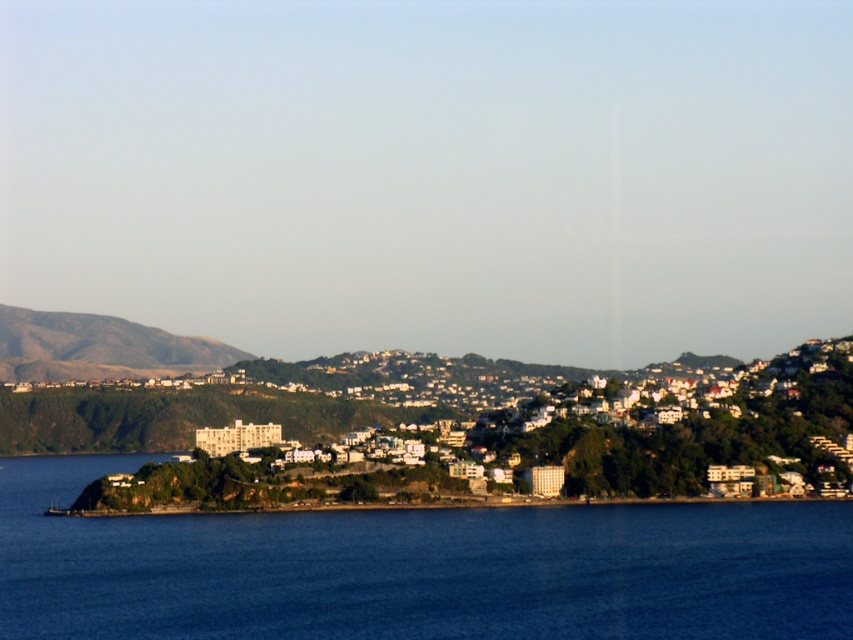
Consider the image. You are a drone operator tasked with capturing aerial footage of the blue liquid water at lower left and the white matte building at center. Based on their relative heights, which object should you focus on first to ensure proper framing?

The blue liquid water at lower left is much taller than the white matte building at center, so you should focus on the blue liquid water at lower left first to ensure proper framing.

Based on the photo, you are a photographer planning to capture the white matte building at center and the blue liquid water at lower left in a single shot. Based on their positions, which object should you frame first to ensure both are included in the composition?

The blue liquid water at lower left is positioned on the left side of white matte building at center, so you should frame the white matte building at center first to ensure both are included in the composition.